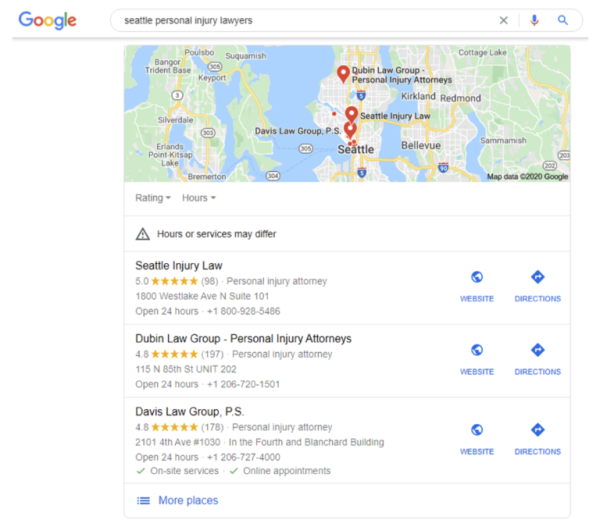
This screenshot has width=600, height=520. In order to click on map in this screenshot , I will do `click(237, 104)`.